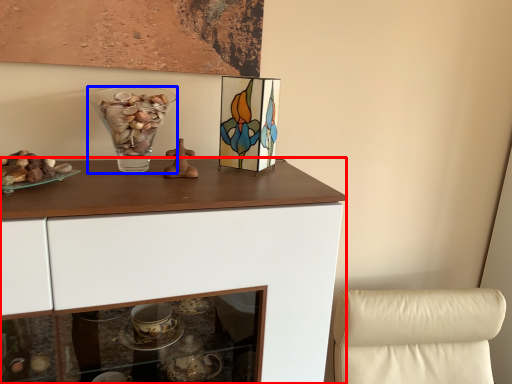
Question: Which object is closer to the camera taking this photo, cabinetry (highlighted by a red box) or vase (highlighted by a blue box)?

Choices:
 (A) cabinetry
 (B) vase

Answer: (A)